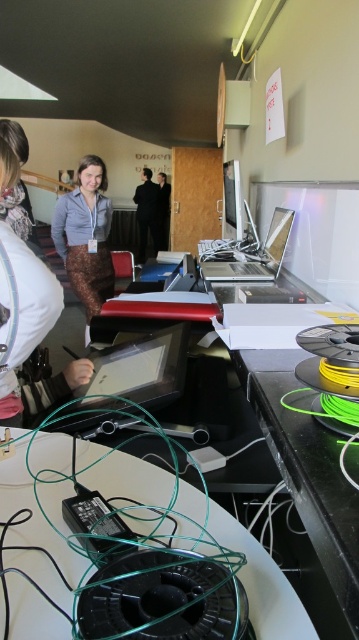
You are organizing a tech conference and need to place a matte black tablet at center and a dark gray suit at center on a table. Which object should you place first if you want to ensure there is enough space for both?

Since the matte black tablet at center is smaller than the dark gray suit at center, you should place the dark gray suit at center first to ensure there is enough space for both objects.

You are standing in a workspace and see a point marked at coordinates (262, 582). What object is located at this point?

The point at coordinates (262, 582) indicates the green wire at lower center.